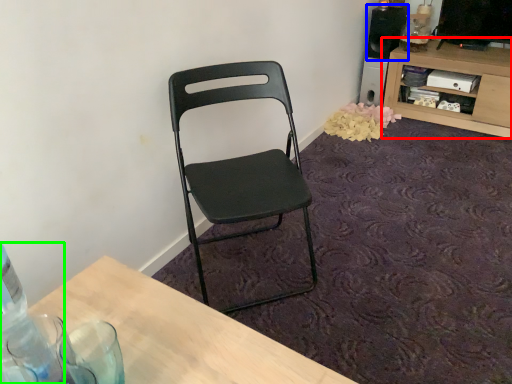
Question: Based on their relative distances, which object is nearer to shelf (highlighted by a red box)? Choose from loudspeaker (highlighted by a blue box) and bottle (highlighted by a green box).

Choices:
 (A) loudspeaker
 (B) bottle

Answer: (A)